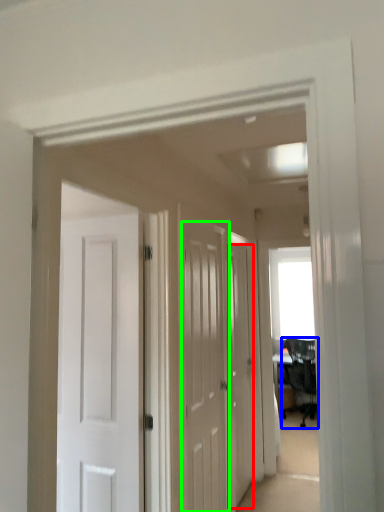
Question: Which object is positioned closest to door (highlighted by a red box)? Select from chair (highlighted by a blue box) and door (highlighted by a green box).

Choices:
 (A) chair
 (B) door

Answer: (B)